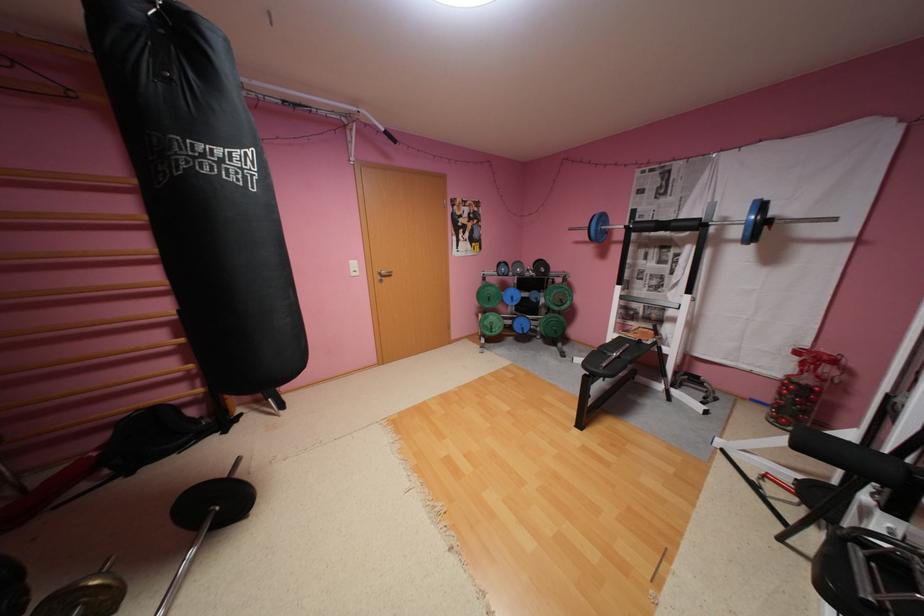
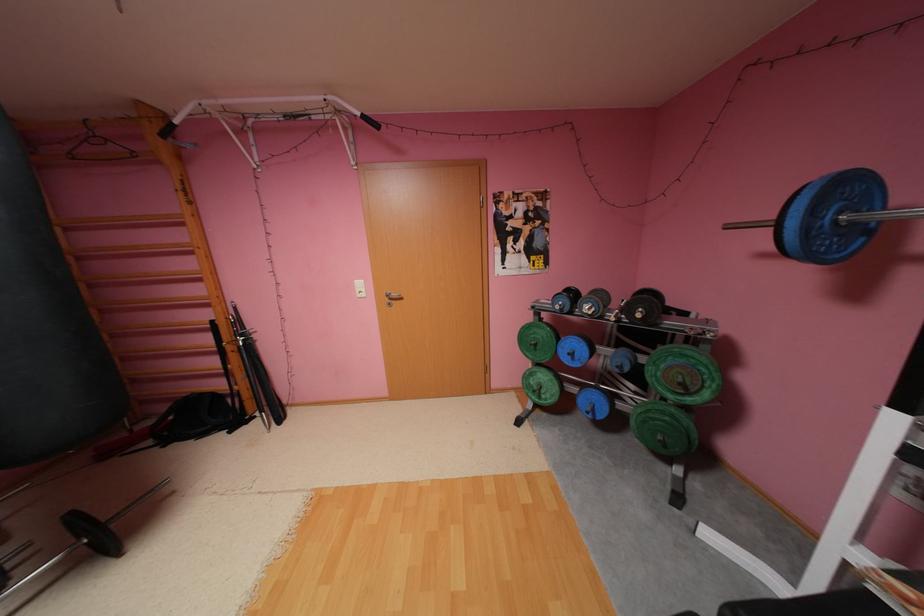
Find the pixel in the second image that matches pixel 612 217 in the first image.

(855, 188)